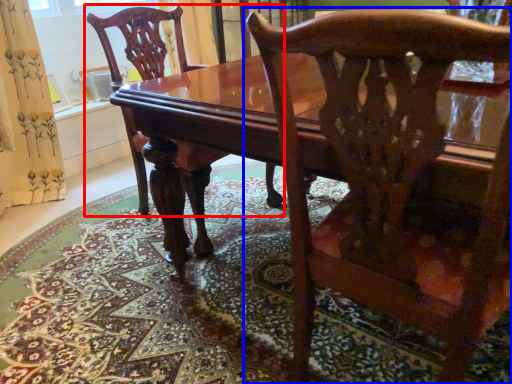
Question: Which of the following is the farthest to the observer, chair (highlighted by a red box) or chair (highlighted by a blue box)?

Choices:
 (A) chair
 (B) chair

Answer: (A)